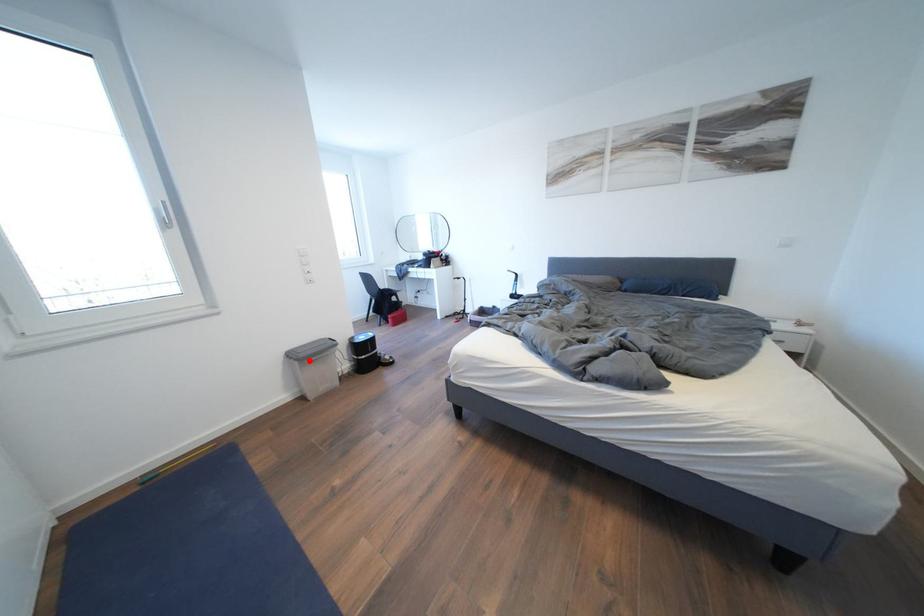
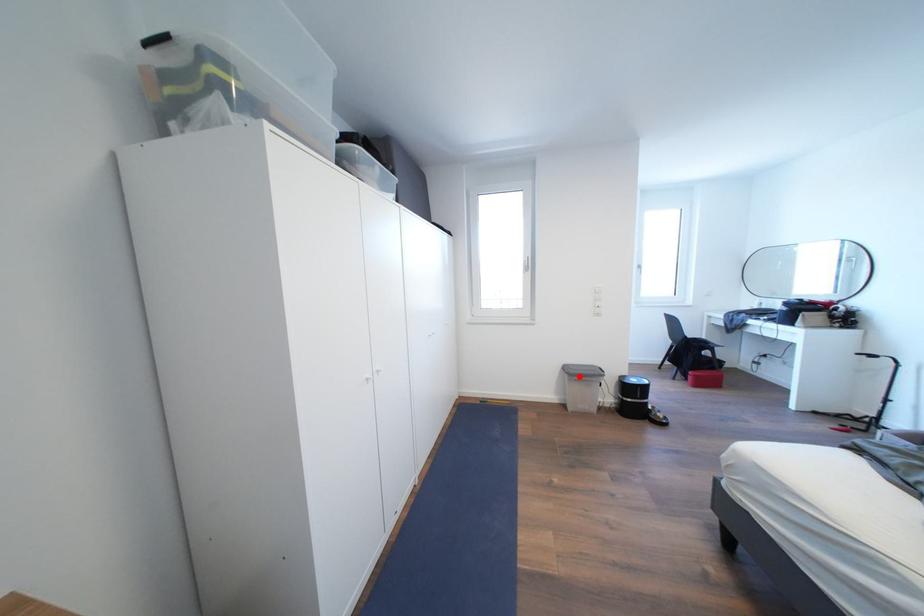
I am providing you with two images of the same scene from different viewpoints. A red point is marked on the first image and another point is marked on the second image. Does the point marked in image1 correspond to the same location as the one in image2?

Yes